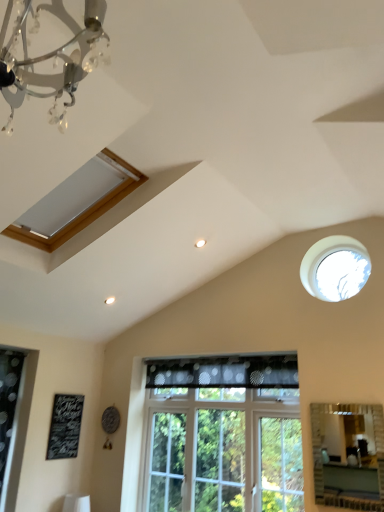
Question: Is matte silver mirror at lower right touching black chalkboard at lower left?

Choices:
 (A) yes
 (B) no

Answer: (B)

Question: Is matte silver mirror at lower right bigger than black chalkboard at lower left?

Choices:
 (A) yes
 (B) no

Answer: (A)

Question: From a real-world perspective, is matte silver mirror at lower right beneath black chalkboard at lower left?

Choices:
 (A) no
 (B) yes

Answer: (B)

Question: Considering the relative sizes of matte silver mirror at lower right and black chalkboard at lower left in the image provided, is matte silver mirror at lower right smaller than black chalkboard at lower left?

Choices:
 (A) no
 (B) yes

Answer: (A)

Question: Is matte silver mirror at lower right not within black chalkboard at lower left?

Choices:
 (A) no
 (B) yes

Answer: (B)

Question: Is matte wooden window at upper left, which ranks as the first window in left-to-right order, taller or shorter than matte silver mirror at lower right?

Choices:
 (A) tall
 (B) short

Answer: (B)

Question: Would you say matte wooden window at upper left, placed as the third window when sorted from bottom to top, is inside or outside matte silver mirror at lower right?

Choices:
 (A) outside
 (B) inside

Answer: (A)

Question: Considering the positions of matte wooden window at upper left, placed as the third window when sorted from bottom to top, and matte silver mirror at lower right in the image, is matte wooden window at upper left, placed as the third window when sorted from bottom to top, wider or thinner than matte silver mirror at lower right?

Choices:
 (A) wide
 (B) thin

Answer: (A)

Question: Considering their positions, is matte wooden window at upper left, which ranks as the first window in left-to-right order, located in front of or behind matte silver mirror at lower right?

Choices:
 (A) behind
 (B) front

Answer: (B)

Question: Is transparent glass window at upper right, which ranks as the 2th window in bottom-to-top order, to the left or to the right of clear glass window at center, the 2th window when ordered from left to right, in the image?

Choices:
 (A) left
 (B) right

Answer: (B)

Question: In terms of height, does transparent glass window at upper right, arranged as the second window when viewed from the top, look taller or shorter compared to clear glass window at center, the 2th window when ordered from left to right?

Choices:
 (A) short
 (B) tall

Answer: (A)

Question: Looking at the image, does transparent glass window at upper right, which ranks as the 2th window in bottom-to-top order, seem bigger or smaller compared to clear glass window at center, the 1th window when ordered from bottom to top?

Choices:
 (A) big
 (B) small

Answer: (B)

Question: Is transparent glass window at upper right, which is counted as the 1th window, starting from the right, inside or outside of clear glass window at center, the 2th window when ordered from left to right?

Choices:
 (A) inside
 (B) outside

Answer: (B)

Question: From a real-world perspective, is clear glass window at center, the 2th window when ordered from left to right, physically located above or below matte silver mirror at lower right?

Choices:
 (A) below
 (B) above

Answer: (B)

Question: Is clear glass window at center, arranged as the 2th window when viewed from the right, bigger or smaller than matte silver mirror at lower right?

Choices:
 (A) small
 (B) big

Answer: (B)